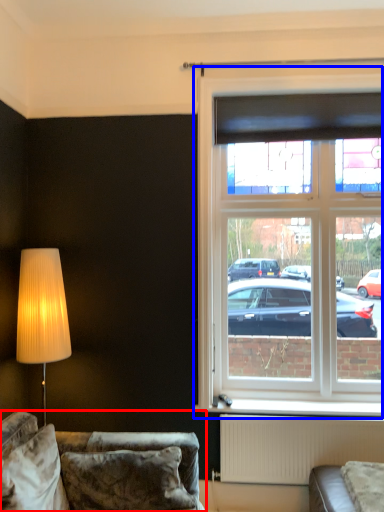
Question: Among these objects, which one is farthest to the camera, studio couch (highlighted by a red box) or window (highlighted by a blue box)?

Choices:
 (A) studio couch
 (B) window

Answer: (B)